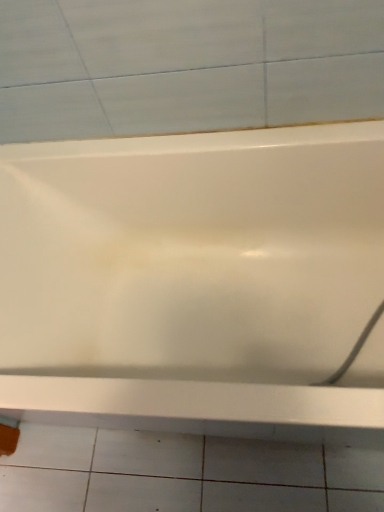
Where is `free space above white glossy ceramic tile at lower center (from a real-world perspective)`? free space above white glossy ceramic tile at lower center (from a real-world perspective) is located at coordinates (175, 474).